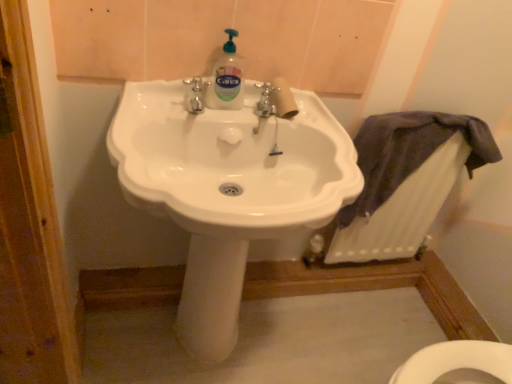
Locate an element on the screen. The width and height of the screenshot is (512, 384). vacant space in front of translucent plastic bottle at center is located at coordinates (199, 118).